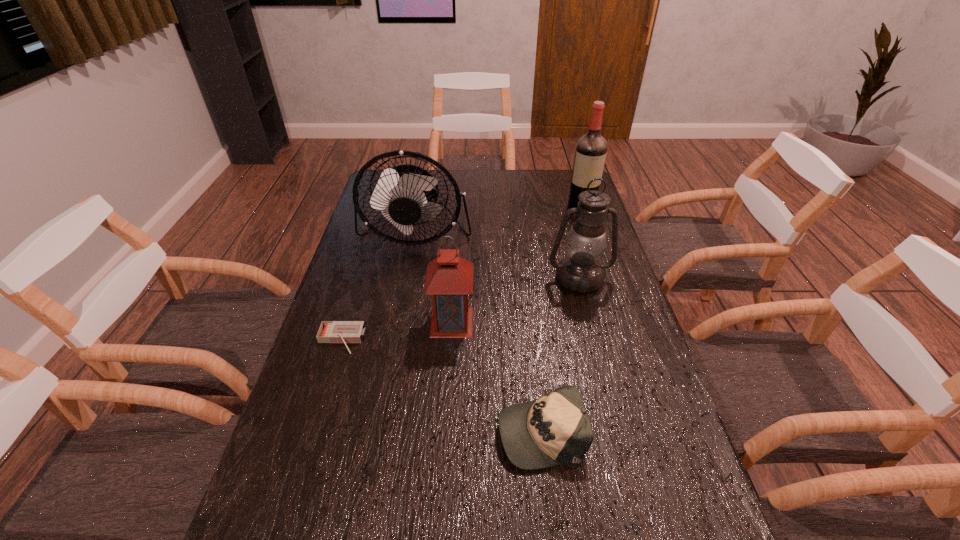
Where is `liquor`? The height and width of the screenshot is (540, 960). liquor is located at coordinates (590, 153).

Find the location of a particular element. fan is located at coordinates (403, 194).

Identify the location of the third farthest object. (580, 271).

Where is `lantern`? The width and height of the screenshot is (960, 540). lantern is located at coordinates (449, 280).

Locate an element on the screen. baseball cap is located at coordinates (556, 429).

This screenshot has width=960, height=540. Identify the location of the second shortest object. (556, 429).

The image size is (960, 540). I want to click on matchbox, so click(x=345, y=332).

The height and width of the screenshot is (540, 960). Identify the location of free spot located 0.240m on the front-facing side of the liquor. (596, 255).

The height and width of the screenshot is (540, 960). Identify the location of vacant space located 0.320m in front of the fan, directing airflow. (396, 333).

This screenshot has height=540, width=960. Find the location of `free region located 0.240m on the left of the third farthest object`. free region located 0.240m on the left of the third farthest object is located at coordinates (470, 278).